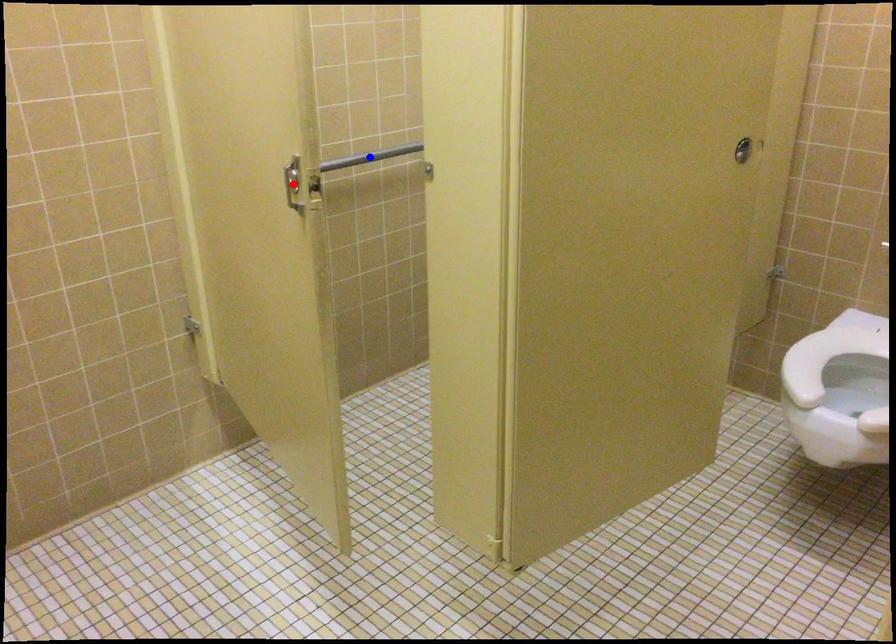
Question: Two points are marked on the image. Which point is closer to the camera?

Choices:
 (A) Blue point is closer.
 (B) Red point is closer.

Answer: (B)